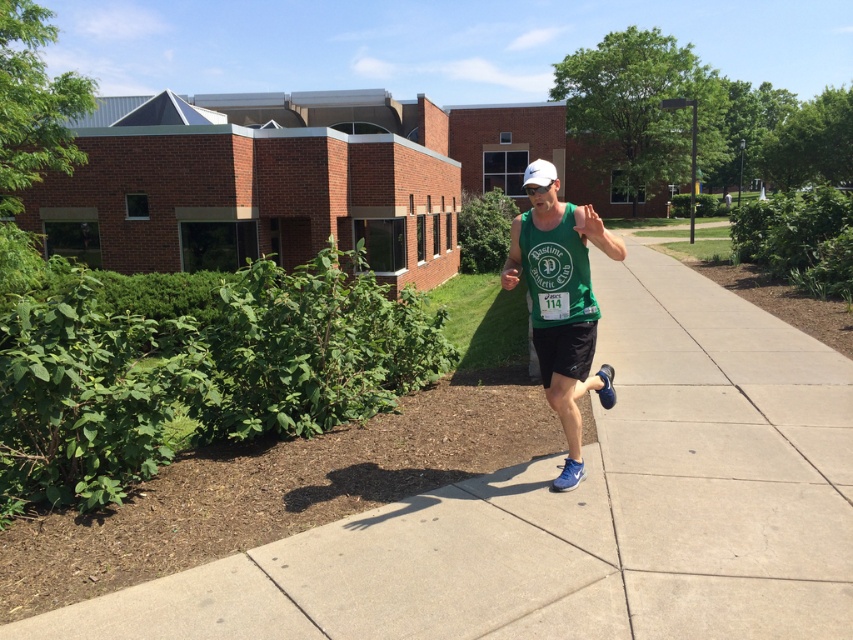
You are a photographer trying to capture the runner in the image. Since the gray concrete sidewalk at center and the green fabric tank top at center are both in the frame, which object should you focus on to ensure the larger one is clearly visible?

The gray concrete sidewalk at center is bigger than the green fabric tank top at center, so you should focus on the gray concrete sidewalk at center to ensure the larger object is clearly visible.

You are a photographer trying to capture the runner. You notice the gray concrete sidewalk at center and the green fabric tank top at center. Which object is closer to the ground?

The gray concrete sidewalk at center is closer to the ground since it has a lesser height compared to the green fabric tank top at center.

You are a photographer trying to capture the runner in the image. You want to ensure the gray concrete sidewalk at center and the green fabric tank top at center are both visible in your shot. Which object should you focus on to ensure both are in frame without zooming in or out?

The gray concrete sidewalk at center is wider than the green fabric tank top at center, so focusing on the sidewalk will help ensure both are in frame since it takes up more space.